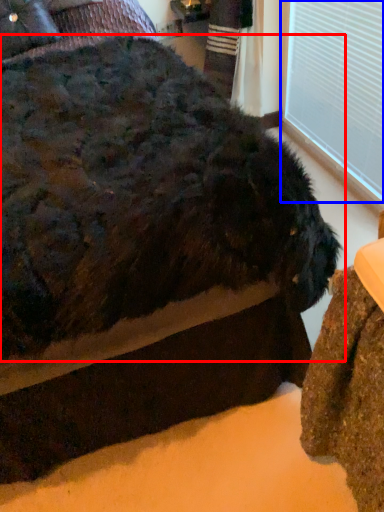
Question: Among these objects, which one is farthest to the camera, dog (highlighted by a red box) or window frame (highlighted by a blue box)?

Choices:
 (A) dog
 (B) window frame

Answer: (B)